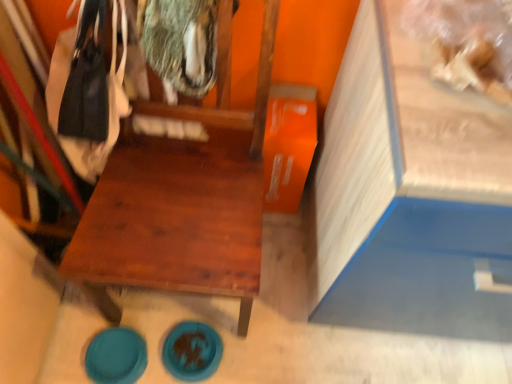
Identify the location of vacant area that lies to the right of blue matte plate at lower center, which is counted as the 1th plate, starting from the right. (253, 348).